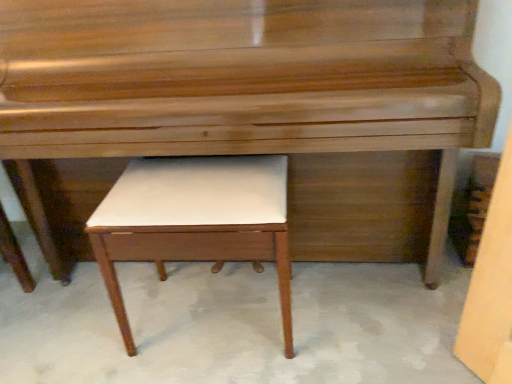
The image size is (512, 384). Find the location of `free spot below white leather stool at center (from a real-world perspective)`. free spot below white leather stool at center (from a real-world perspective) is located at coordinates (212, 329).